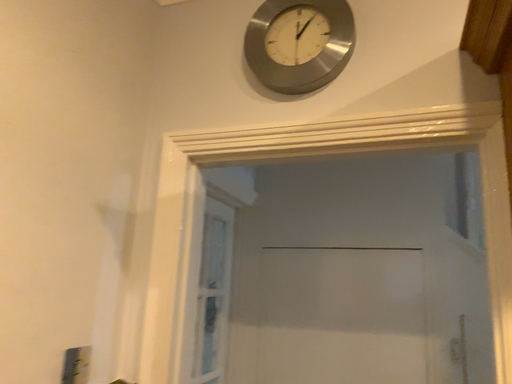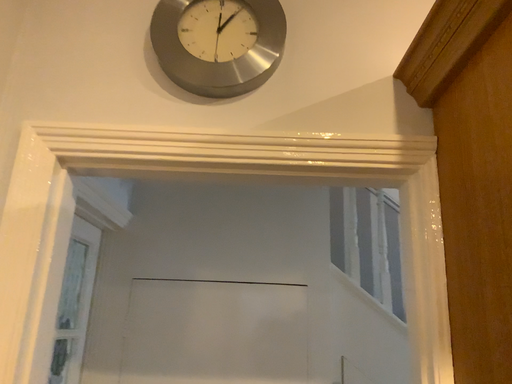
Question: How did the camera likely rotate when shooting the video?

Choices:
 (A) rotated left
 (B) rotated right

Answer: (B)